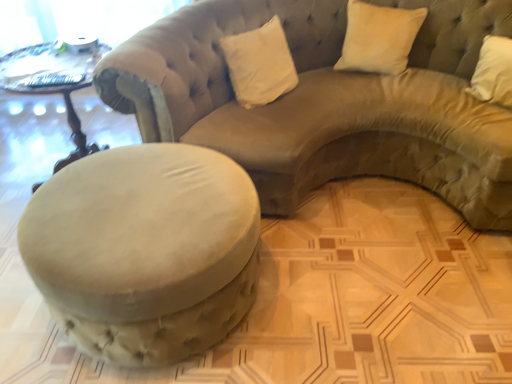
Where is `white velvet pillow at upper right, acting as the first pillow starting from the right`? The height and width of the screenshot is (384, 512). white velvet pillow at upper right, acting as the first pillow starting from the right is located at coordinates (378, 38).

Identify the location of white velvet pillow at upper center, the second pillow when ordered from right to left. This screenshot has height=384, width=512. (260, 64).

Locate an element on the screen. The image size is (512, 384). suede beige studio couch at center is located at coordinates (327, 102).

Is wooden carved table at left in contact with suede beige studio couch at center?

No, wooden carved table at left is not in contact with suede beige studio couch at center.

The width and height of the screenshot is (512, 384). Identify the location of table below the suede beige studio couch at center (from a real-world perspective). (53, 83).

Can you confirm if wooden carved table at left is positioned to the left of suede beige studio couch at center?

Indeed, wooden carved table at left is positioned on the left side of suede beige studio couch at center.

Does white velvet pillow at upper center, the second pillow when ordered from right to left, have a lesser width compared to white velvet pillow at upper right, acting as the first pillow starting from the right?

Correct, the width of white velvet pillow at upper center, the second pillow when ordered from right to left, is less than that of white velvet pillow at upper right, acting as the first pillow starting from the right.

Which is behind, white velvet pillow at upper center, the second pillow when ordered from right to left, or white velvet pillow at upper right, acting as the first pillow starting from the right?

white velvet pillow at upper right, acting as the first pillow starting from the right.

Is white velvet pillow at upper center, placed as the first pillow when sorted from left to right, facing towards white velvet pillow at upper right, marked as the 2th pillow in a left-to-right arrangement?

A: No, white velvet pillow at upper center, placed as the first pillow when sorted from left to right, is not oriented towards white velvet pillow at upper right, marked as the 2th pillow in a left-to-right arrangement.

Is white velvet pillow at upper right, acting as the first pillow starting from the right, closer to camera compared to suede beige studio couch at center?

Answer: No, it is behind suede beige studio couch at center.

Is white velvet pillow at upper right, acting as the first pillow starting from the right, thinner than suede beige studio couch at center?

Indeed, white velvet pillow at upper right, acting as the first pillow starting from the right, has a lesser width compared to suede beige studio couch at center.

Who is taller, white velvet pillow at upper right, acting as the first pillow starting from the right, or suede beige studio couch at center?

Standing taller between the two is suede beige studio couch at center.

From a real-world perspective, relative to suede beige studio couch at center, is white velvet pillow at upper right, marked as the 2th pillow in a left-to-right arrangement, vertically above or below?

white velvet pillow at upper right, marked as the 2th pillow in a left-to-right arrangement, is above suede beige studio couch at center.

Looking at this image, from a real-world perspective, is wooden carved table at left below suede ottoman at lower left?

No, from a real-world perspective, wooden carved table at left is not under suede ottoman at lower left.

Does point (21, 50) come closer to viewer compared to point (61, 262)?

That is False.

From the image's perspective, is wooden carved table at left over suede ottoman at lower left?

Indeed, from the image's perspective, wooden carved table at left is shown above suede ottoman at lower left.

Is wooden carved table at left shorter than suede ottoman at lower left?

Incorrect, the height of wooden carved table at left does not fall short of that of suede ottoman at lower left.

From the image's perspective, does white velvet pillow at upper right, acting as the first pillow starting from the right, appear lower than suede ottoman at lower left?

No, from the image's perspective, white velvet pillow at upper right, acting as the first pillow starting from the right, is not beneath suede ottoman at lower left.

Can you confirm if white velvet pillow at upper right, acting as the first pillow starting from the right, is thinner than suede ottoman at lower left?

Indeed, white velvet pillow at upper right, acting as the first pillow starting from the right, has a lesser width compared to suede ottoman at lower left.

Between white velvet pillow at upper right, acting as the first pillow starting from the right, and suede ottoman at lower left, which one has less height?

white velvet pillow at upper right, acting as the first pillow starting from the right, is shorter.

Can you confirm if suede beige studio couch at center is smaller than white velvet pillow at upper center, placed as the first pillow when sorted from left to right?

No, suede beige studio couch at center is not smaller than white velvet pillow at upper center, placed as the first pillow when sorted from left to right.

Is suede beige studio couch at center oriented towards white velvet pillow at upper center, placed as the first pillow when sorted from left to right?

Yes, suede beige studio couch at center faces towards white velvet pillow at upper center, placed as the first pillow when sorted from left to right.

In terms of width, does suede beige studio couch at center look wider or thinner when compared to white velvet pillow at upper center, the second pillow when ordered from right to left?

In the image, suede beige studio couch at center appears to be wider than white velvet pillow at upper center, the second pillow when ordered from right to left.

Is white velvet pillow at upper right, marked as the 2th pillow in a left-to-right arrangement, to the left of white velvet pillow at upper center, placed as the first pillow when sorted from left to right, from the viewer's perspective?

In fact, white velvet pillow at upper right, marked as the 2th pillow in a left-to-right arrangement, is to the right of white velvet pillow at upper center, placed as the first pillow when sorted from left to right.

Is white velvet pillow at upper right, marked as the 2th pillow in a left-to-right arrangement, looking in the opposite direction of white velvet pillow at upper center, placed as the first pillow when sorted from left to right?

No, white velvet pillow at upper right, marked as the 2th pillow in a left-to-right arrangement,'s orientation is not away from white velvet pillow at upper center, placed as the first pillow when sorted from left to right.

Does point (376, 54) come farther from viewer compared to point (248, 99)?

That is True.

Between white velvet pillow at upper right, acting as the first pillow starting from the right, and white velvet pillow at upper center, the second pillow when ordered from right to left, which one has less height?

With less height is white velvet pillow at upper right, acting as the first pillow starting from the right.

What are the coordinates of `studio couch in front of the wooden carved table at left` in the screenshot? It's located at coord(327,102).

Where is `pillow that is on the left side of white velvet pillow at upper right, marked as the 2th pillow in a left-to-right arrangement`? pillow that is on the left side of white velvet pillow at upper right, marked as the 2th pillow in a left-to-right arrangement is located at coordinates (260, 64).

Looking at the image, which one is located further to suede beige studio couch at center, suede ottoman at lower left or white velvet pillow at upper right, marked as the 2th pillow in a left-to-right arrangement?

Among the two, suede ottoman at lower left is located further to suede beige studio couch at center.

Based on their spatial positions, is wooden carved table at left or suede beige studio couch at center closer to white velvet pillow at upper center, the second pillow when ordered from right to left?

The object closer to white velvet pillow at upper center, the second pillow when ordered from right to left, is suede beige studio couch at center.

Based on their spatial positions, is suede ottoman at lower left or white velvet pillow at upper center, placed as the first pillow when sorted from left to right, closer to suede beige studio couch at center?

The object closer to suede beige studio couch at center is white velvet pillow at upper center, placed as the first pillow when sorted from left to right.

Estimate the real-world distances between objects in this image. Which object is further from suede beige studio couch at center, wooden carved table at left or suede ottoman at lower left?

wooden carved table at left is further to suede beige studio couch at center.

In the scene shown: Considering their positions, is suede ottoman at lower left positioned further to white velvet pillow at upper center, the second pillow when ordered from right to left, than white velvet pillow at upper right, acting as the first pillow starting from the right?

suede ottoman at lower left.

Estimate the real-world distances between objects in this image. Which object is further from wooden carved table at left, white velvet pillow at upper center, placed as the first pillow when sorted from left to right, or suede ottoman at lower left?

Among the two, suede ottoman at lower left is located further to wooden carved table at left.

Based on their spatial positions, is white velvet pillow at upper right, acting as the first pillow starting from the right, or suede beige studio couch at center closer to suede ottoman at lower left?

suede beige studio couch at center.

When comparing their distances from wooden carved table at left, does suede ottoman at lower left or white velvet pillow at upper center, placed as the first pillow when sorted from left to right, seem closer?

white velvet pillow at upper center, placed as the first pillow when sorted from left to right, is positioned closer to the anchor wooden carved table at left.

Locate an element on the screen. This screenshot has width=512, height=384. swivel chair located between wooden carved table at left and white velvet pillow at upper right, acting as the first pillow starting from the right, in the left-right direction is located at coordinates 145,250.

At what (x,y) coordinates should I click in order to perform the action: click on pillow situated between wooden carved table at left and suede beige studio couch at center from left to right. Please return your answer as a coordinate pair (x, y). The width and height of the screenshot is (512, 384). Looking at the image, I should click on (260, 64).

Locate an element on the screen. pillow between white velvet pillow at upper right, acting as the first pillow starting from the right, and suede ottoman at lower left vertically is located at coordinates (260, 64).

You are a GUI agent. You are given a task and a screenshot of the screen. Output one action in this format:
    pyautogui.click(x=<x>, y=<y>)
    Task: Click on the swivel chair located between wooden carved table at left and white velvet pillow at upper center, placed as the first pillow when sorted from left to right, in the left-right direction
    
    Given the screenshot: What is the action you would take?
    pyautogui.click(x=145, y=250)